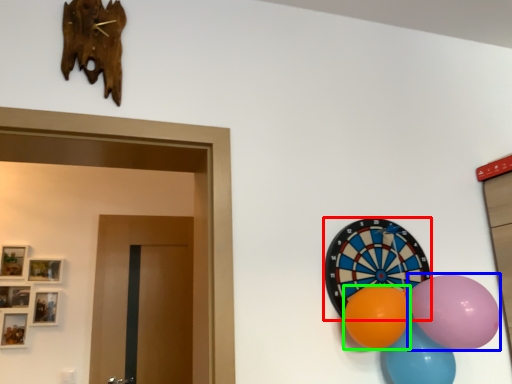
Question: Which is nearer to the oval (highlighted by a red box)? balloon (highlighted by a blue box) or balloon (highlighted by a green box).

Choices:
 (A) balloon
 (B) balloon

Answer: (B)